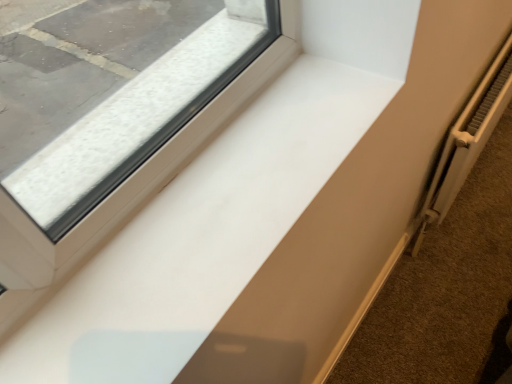
You are a GUI agent. You are given a task and a screenshot of the screen. Output one action in this format:
    pyautogui.click(x=<x>, y=<y>)
    Task: Click on the vacant area on top of white glossy window sill at center (from a real-world perspective)
    The image size is (512, 384).
    Given the screenshot: What is the action you would take?
    pyautogui.click(x=169, y=263)